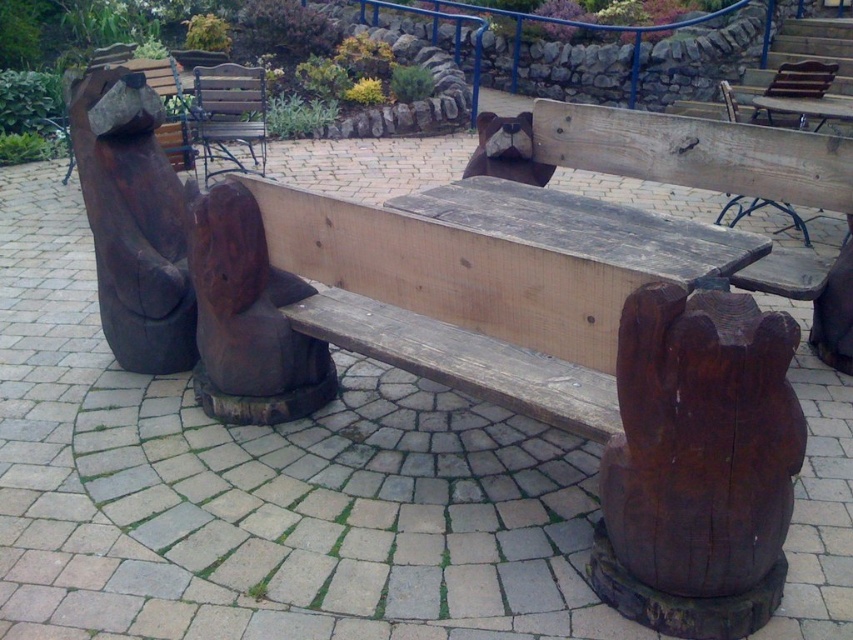
You are sitting on the wooden slats bench at center and want to place a small potted plant on the ground. Where should you put it so that it is near the rustic wood bear at left but not directly under the bench?

You should place the small potted plant near the rustic wood bear at left but not under the wooden slats bench at center since the rustic wood bear at left is already positioned under the bench. Therefore, placing it near the bear but outside the bench area would be appropriate.

You are standing on the paved patio and want to walk from point A to point B. Point A is at coordinates point [128,280], and point B is at coordinates point [248,80]. Which direction should you move relative to the bench to reach point B from point A?

To move from point A to point B, you should move towards the garden area since point A is in front of point B relative to the bench, meaning point B is behind the bench from your starting position.